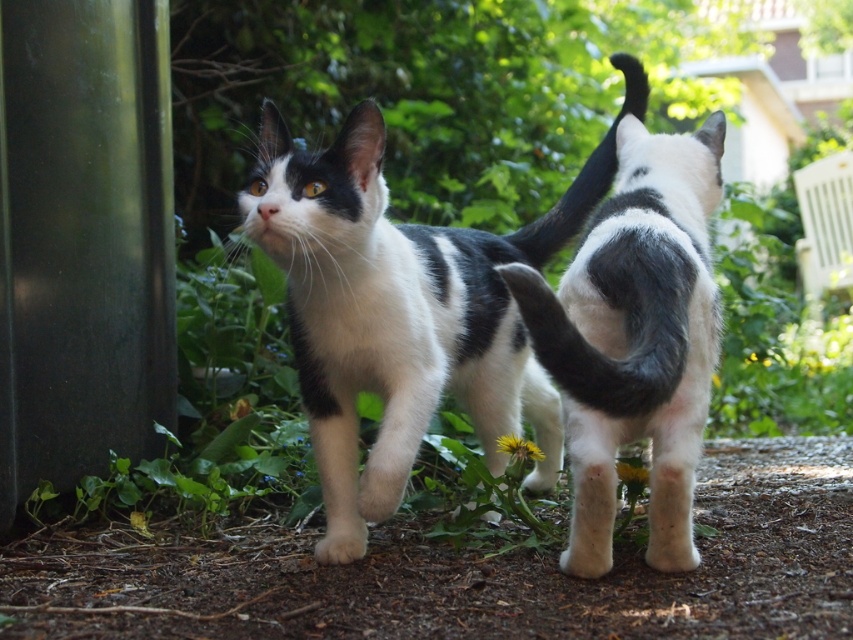
You are a photographer trying to capture a closeup of the black soft fur tail at center. Your camera has a minimum focusing distance of 4 feet. Can you take the photo without moving the camera or the tail?

The black soft fur tail at center is 4.82 feet from camera, so yes, the photographer can take the photo because the distance is within the camera minimum focusing distance of 4 feet.